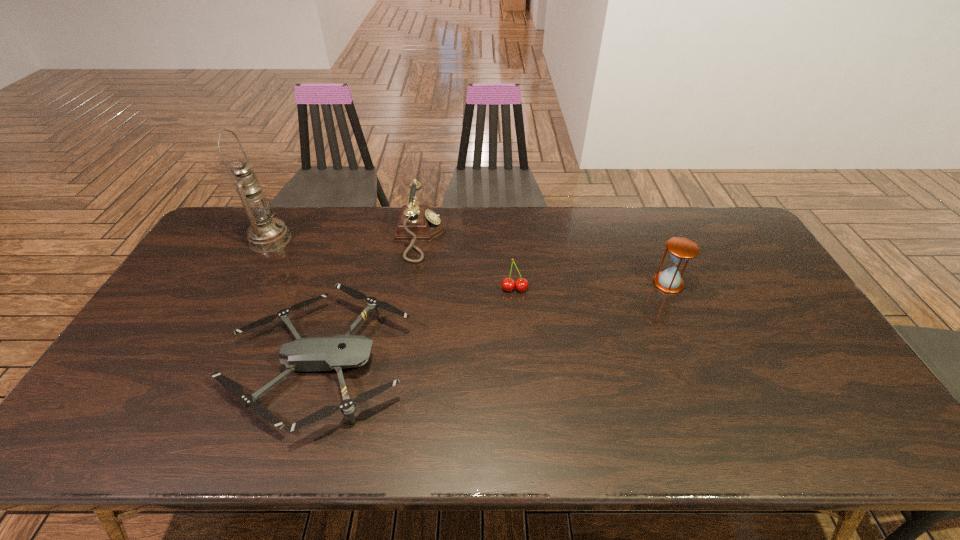
The height and width of the screenshot is (540, 960). What are the coordinates of `blank space located with the stems of the fourth object from left to right pointing upwards` in the screenshot? It's located at (522, 383).

You are a GUI agent. You are given a task and a screenshot of the screen. Output one action in this format:
    pyautogui.click(x=<x>, y=<y>)
    Task: Click on the vacant area situated with a camera mounted on the front of the shortest object
    
    Given the screenshot: What is the action you would take?
    pyautogui.click(x=558, y=362)

Identify the location of oil lamp present at the far edge. The width and height of the screenshot is (960, 540). (265, 234).

This screenshot has width=960, height=540. I want to click on telephone present at the far edge, so click(417, 223).

This screenshot has width=960, height=540. Identify the location of object at the near edge. (338, 352).

Locate an element on the screen. object that is at the left edge is located at coordinates (265, 234).

Locate an element on the screen. object positioned at the far left corner is located at coordinates (265, 234).

What are the coordinates of `vacant area at the far edge` in the screenshot? It's located at (296, 214).

At what (x,y) coordinates should I click in order to perform the action: click on vacant space at the near edge of the desktop. Please return your answer as a coordinate pair (x, y). Looking at the image, I should click on (391, 434).

Where is `vacant area at the left edge`? The height and width of the screenshot is (540, 960). vacant area at the left edge is located at coordinates (141, 375).